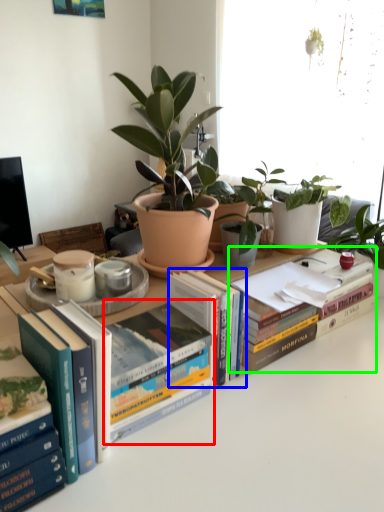
Question: Estimate the real-world distances between objects in this image. Which object is farther from book (highlighted by a red box), book (highlighted by a blue box) or book (highlighted by a green box)?

Choices:
 (A) book
 (B) book

Answer: (B)